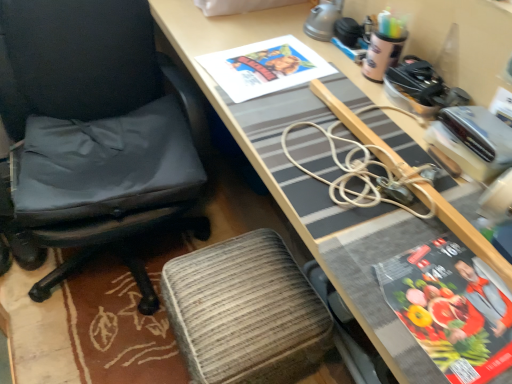
Question: Is textured fabric stool at lower center spatially inside wooden desk at center, or outside of it?

Choices:
 (A) outside
 (B) inside

Answer: (B)

Question: From the image's perspective, relative to wooden desk at center, is textured fabric stool at lower center above or below?

Choices:
 (A) below
 (B) above

Answer: (A)

Question: Which object is positioned closest to the wooden desk at center?

Choices:
 (A) matte paper magazine at right
 (B) black fabric chair at left
 (C) matte paper book cover at upper center
 (D) textured fabric stool at lower center

Answer: (C)

Question: Estimate the real-world distances between objects in this image. Which object is farther from the wooden desk at center?

Choices:
 (A) black fabric chair at left
 (B) textured fabric stool at lower center
 (C) matte paper magazine at right
 (D) matte paper book cover at upper center

Answer: (B)